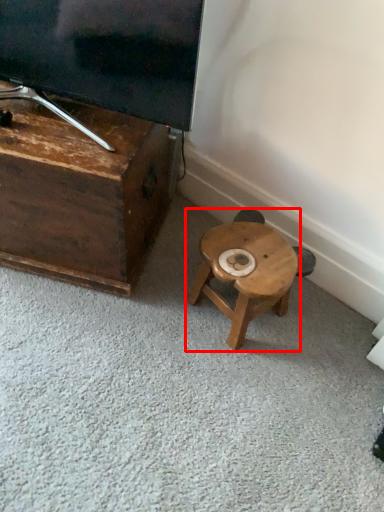
Question: From the image's perspective, where is stool (annotated by the red box) located in relation to furniture in the image?

Choices:
 (A) below
 (B) above

Answer: (A)